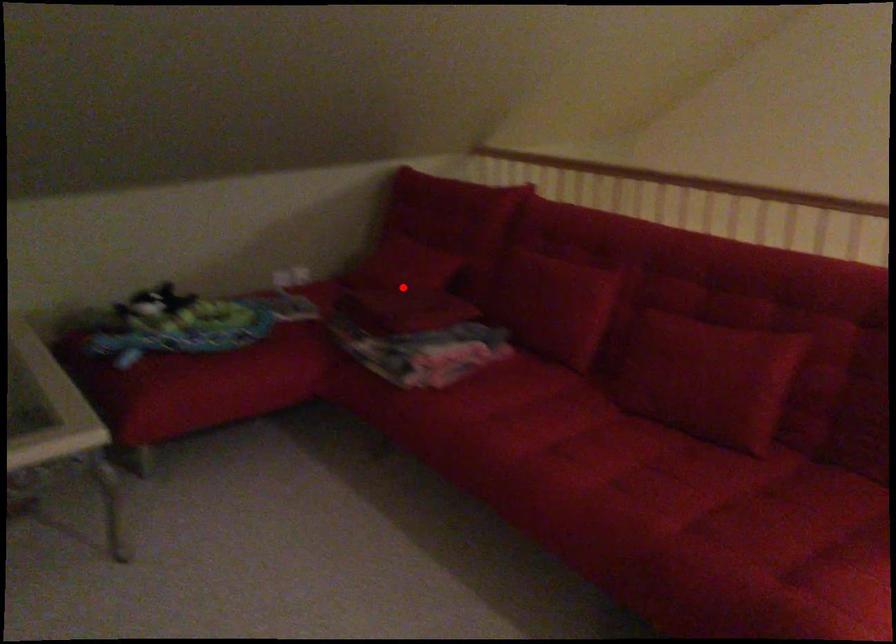
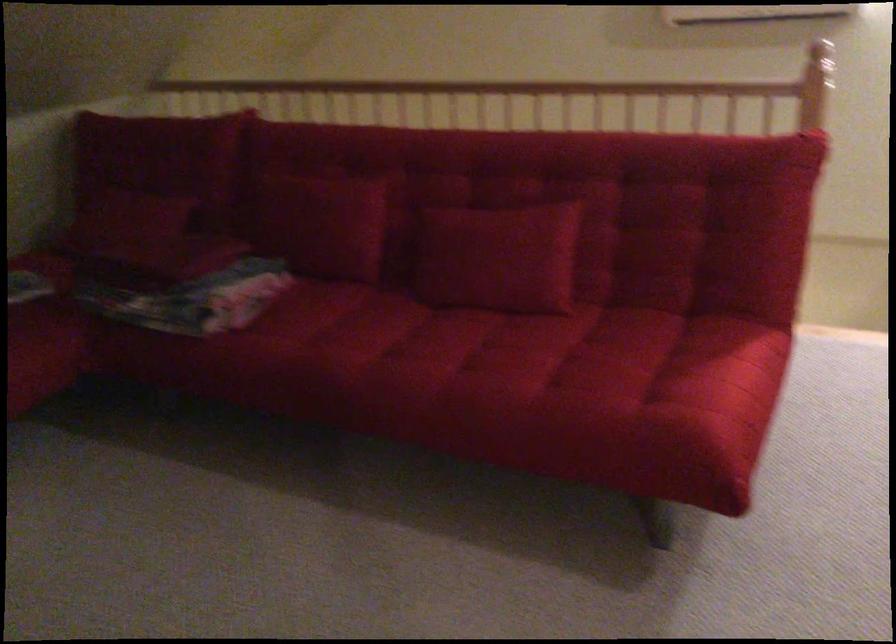
Question: I am providing you with two images of the same scene from different viewpoints. A red point is marked on the first image. At the location where the point appears in image 1, is it still visible in image 2?

Choices:
 (A) Yes
 (B) No

Answer: (B)